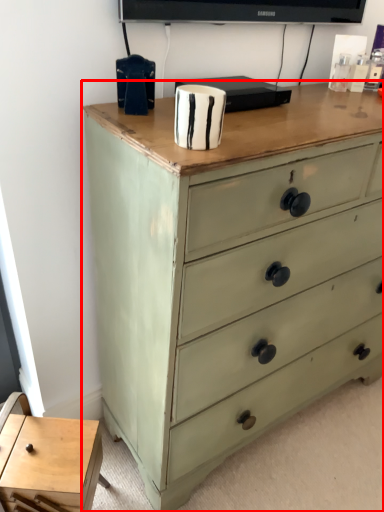
Question: In this image, where is chest of drawers (annotated by the red box) located relative to table?

Choices:
 (A) left
 (B) right

Answer: (B)